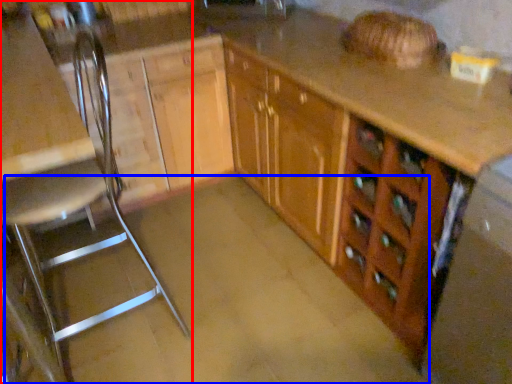
Question: Which object appears farthest to the camera in this image, chair (highlighted by a red box) or concrete (highlighted by a blue box)?

Choices:
 (A) chair
 (B) concrete

Answer: (B)